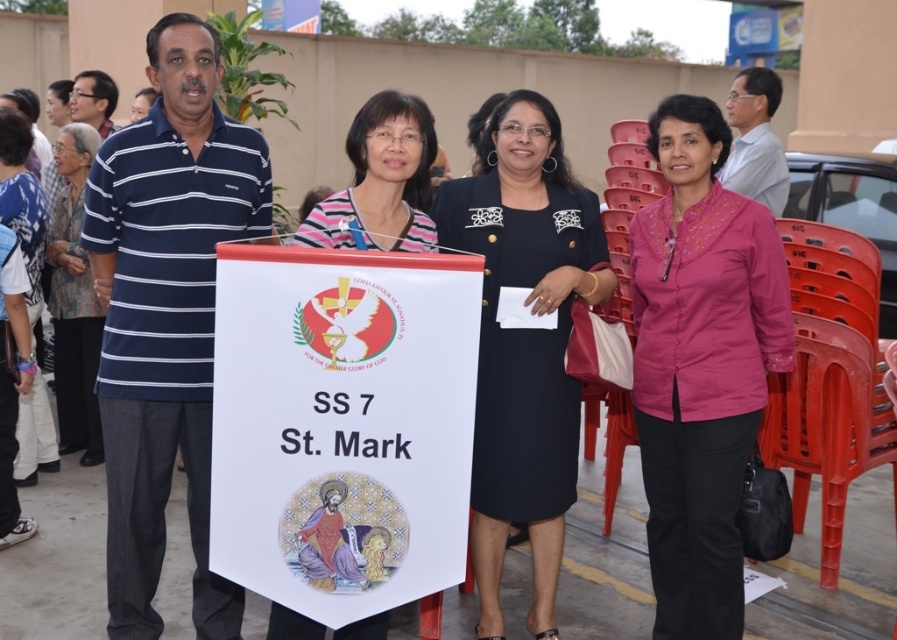
You are a photographer adjusting your camera to capture the group photo. You notice the striped shirt at center and the blue printed dress at left. Based on their positions, which clothing item is positioned lower in the frame?

The striped shirt at center is located below the blue printed dress at left, so the striped shirt at center is positioned lower in the frame.